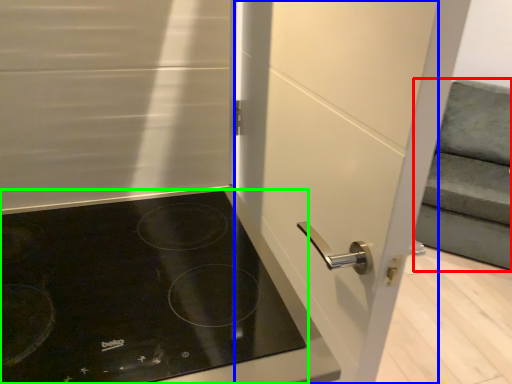
Question: Estimate the real-world distances between objects in this image. Which object is closer to armchair (highlighted by a red box), screen door (highlighted by a blue box) or gas stove (highlighted by a green box)?

Choices:
 (A) screen door
 (B) gas stove

Answer: (A)